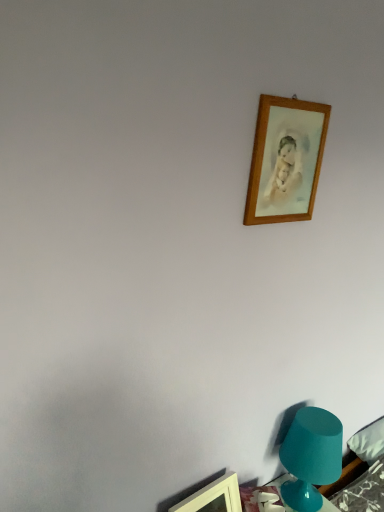
How much space does wooden picture frame at upper right, which is counted as the second picture frame, starting from the bottom, occupy horizontally?

It is 0.87 inches.

The width and height of the screenshot is (384, 512). What do you see at coordinates (286, 160) in the screenshot?
I see `wooden picture frame at upper right, which ranks as the 1th picture frame in right-to-left order` at bounding box center [286, 160].

The width and height of the screenshot is (384, 512). Find the location of `teal glass lamp at lower right`. teal glass lamp at lower right is located at coordinates (305, 468).

Locate an element on the screen. wooden picture frame at upper right, positioned as the 2th picture frame in right-to-left order is located at coordinates (214, 497).

How different are the orientations of teal glass lamp at lower right and wooden picture frame at upper right, acting as the first picture frame starting from the top, in degrees?

2.24 degrees.

Is wooden picture frame at upper right, which ranks as the second picture frame in left-to-right order, located within teal glass lamp at lower right?

No, teal glass lamp at lower right does not contain wooden picture frame at upper right, which ranks as the second picture frame in left-to-right order.

Is the depth of teal glass lamp at lower right less than that of wooden picture frame at upper right, which ranks as the second picture frame in left-to-right order?

No, it is behind wooden picture frame at upper right, which ranks as the second picture frame in left-to-right order.

Considering the positions of objects wooden picture frame at upper right, positioned as the 2th picture frame in right-to-left order, and wooden picture frame at upper right, which ranks as the 1th picture frame in right-to-left order, in the image provided, who is more to the left, wooden picture frame at upper right, positioned as the 2th picture frame in right-to-left order, or wooden picture frame at upper right, which ranks as the 1th picture frame in right-to-left order,?

wooden picture frame at upper right, positioned as the 2th picture frame in right-to-left order.

Considering the relative sizes of wooden picture frame at upper right, which ranks as the 1th picture frame in bottom-to-top order, and wooden picture frame at upper right, acting as the first picture frame starting from the top, in the image provided, is wooden picture frame at upper right, which ranks as the 1th picture frame in bottom-to-top order, bigger than wooden picture frame at upper right, acting as the first picture frame starting from the top,?

Correct, wooden picture frame at upper right, which ranks as the 1th picture frame in bottom-to-top order, is larger in size than wooden picture frame at upper right, acting as the first picture frame starting from the top.

Is wooden picture frame at upper right, which is the 2th picture frame from top to bottom, looking in the opposite direction of wooden picture frame at upper right, which is counted as the second picture frame, starting from the bottom?

No, wooden picture frame at upper right, which is the 2th picture frame from top to bottom, is not facing the opposite direction of wooden picture frame at upper right, which is counted as the second picture frame, starting from the bottom.

Does wooden picture frame at upper right, which ranks as the 1th picture frame in bottom-to-top order, have a greater height compared to wooden picture frame at upper right, which ranks as the 1th picture frame in right-to-left order?

Incorrect, the height of wooden picture frame at upper right, which ranks as the 1th picture frame in bottom-to-top order, is not larger of that of wooden picture frame at upper right, which ranks as the 1th picture frame in right-to-left order.

Considering the positions of objects teal glass lamp at lower right and wooden picture frame at upper right, positioned as the 2th picture frame in right-to-left order, in the image provided, who is in front, teal glass lamp at lower right or wooden picture frame at upper right, positioned as the 2th picture frame in right-to-left order,?

wooden picture frame at upper right, positioned as the 2th picture frame in right-to-left order, is more forward.

From the picture: Is teal glass lamp at lower right wider or thinner than wooden picture frame at upper right, positioned as the 2th picture frame in right-to-left order?

Considering their sizes, teal glass lamp at lower right looks broader than wooden picture frame at upper right, positioned as the 2th picture frame in right-to-left order.

In the scene shown: From a real-world perspective, who is located lower, teal glass lamp at lower right or wooden picture frame at upper right, which is the 2th picture frame from top to bottom?

wooden picture frame at upper right, which is the 2th picture frame from top to bottom, from a real-world perspective.

Looking at this image, between wooden picture frame at upper right, which is counted as the second picture frame, starting from the bottom, and teal glass lamp at lower right, which one appears on the left side from the viewer's perspective?

From the viewer's perspective, wooden picture frame at upper right, which is counted as the second picture frame, starting from the bottom, appears more on the left side.

From a real-world perspective, is wooden picture frame at upper right, which ranks as the second picture frame in left-to-right order, physically located above or below teal glass lamp at lower right?

wooden picture frame at upper right, which ranks as the second picture frame in left-to-right order, is situated higher than teal glass lamp at lower right in the real world.

Is wooden picture frame at upper right, which ranks as the 1th picture frame in right-to-left order, with teal glass lamp at lower right?

They are not placed beside each other.

Between wooden picture frame at upper right, which ranks as the 1th picture frame in right-to-left order, and teal glass lamp at lower right, which one has more height?

Standing taller between the two is teal glass lamp at lower right.

Is wooden picture frame at upper right, which is counted as the second picture frame, starting from the bottom, bigger or smaller than wooden picture frame at upper right, which is the 2th picture frame from top to bottom?

Considering their sizes, wooden picture frame at upper right, which is counted as the second picture frame, starting from the bottom, takes up less space than wooden picture frame at upper right, which is the 2th picture frame from top to bottom.

Is wooden picture frame at upper right, which ranks as the 1th picture frame in right-to-left order, with wooden picture frame at upper right, which ranks as the 1th picture frame in bottom-to-top order?

No, wooden picture frame at upper right, which ranks as the 1th picture frame in right-to-left order, is not making contact with wooden picture frame at upper right, which ranks as the 1th picture frame in bottom-to-top order.

Is wooden picture frame at upper right, acting as the first picture frame starting from the top, thinner than wooden picture frame at upper right, positioned as the 2th picture frame in right-to-left order?

Yes, wooden picture frame at upper right, acting as the first picture frame starting from the top, is thinner than wooden picture frame at upper right, positioned as the 2th picture frame in right-to-left order.

From a real-world perspective, is wooden picture frame at upper right, acting as the first picture frame starting from the top, physically located above or below wooden picture frame at upper right, which is the 2th picture frame from top to bottom?

wooden picture frame at upper right, acting as the first picture frame starting from the top, is above wooden picture frame at upper right, which is the 2th picture frame from top to bottom.

Is wooden picture frame at upper right, placed as the 1th picture frame when sorted from left to right, not near teal glass lamp at lower right?

They are positioned close to each other.

From the image's perspective, which object appears higher, wooden picture frame at upper right, positioned as the 2th picture frame in right-to-left order, or teal glass lamp at lower right?

teal glass lamp at lower right.

Which of these two, wooden picture frame at upper right, which ranks as the 1th picture frame in bottom-to-top order, or teal glass lamp at lower right, is wider?

Wider between the two is teal glass lamp at lower right.

Where is `picture frame above the teal glass lamp at lower right (from a real-world perspective)`? Image resolution: width=384 pixels, height=512 pixels. picture frame above the teal glass lamp at lower right (from a real-world perspective) is located at coordinates (286, 160).

The width and height of the screenshot is (384, 512). Find the location of `picture frame below the wooden picture frame at upper right, which ranks as the 1th picture frame in right-to-left order (from the image's perspective)`. picture frame below the wooden picture frame at upper right, which ranks as the 1th picture frame in right-to-left order (from the image's perspective) is located at coordinates (214, 497).

Consider the image. Based on their spatial positions, is wooden picture frame at upper right, acting as the first picture frame starting from the top, or teal glass lamp at lower right further from wooden picture frame at upper right, placed as the 1th picture frame when sorted from left to right?

wooden picture frame at upper right, acting as the first picture frame starting from the top, is positioned further to the anchor wooden picture frame at upper right, placed as the 1th picture frame when sorted from left to right.

From the image, which object appears to be farther from teal glass lamp at lower right, wooden picture frame at upper right, which is counted as the second picture frame, starting from the bottom, or wooden picture frame at upper right, which is the 2th picture frame from top to bottom?

wooden picture frame at upper right, which is counted as the second picture frame, starting from the bottom.

When comparing their distances from teal glass lamp at lower right, does wooden picture frame at upper right, which is the 2th picture frame from top to bottom, or wooden picture frame at upper right, which ranks as the 1th picture frame in right-to-left order, seem further?

Among the two, wooden picture frame at upper right, which ranks as the 1th picture frame in right-to-left order, is located further to teal glass lamp at lower right.

Based on their spatial positions, is teal glass lamp at lower right or wooden picture frame at upper right, placed as the 1th picture frame when sorted from left to right, further from wooden picture frame at upper right, which ranks as the 1th picture frame in right-to-left order?

wooden picture frame at upper right, placed as the 1th picture frame when sorted from left to right, is further to wooden picture frame at upper right, which ranks as the 1th picture frame in right-to-left order.

Looking at this image, from the image, which object appears to be nearer to wooden picture frame at upper right, which is counted as the second picture frame, starting from the bottom, wooden picture frame at upper right, positioned as the 2th picture frame in right-to-left order, or teal glass lamp at lower right?

teal glass lamp at lower right is positioned closer to the anchor wooden picture frame at upper right, which is counted as the second picture frame, starting from the bottom.

Looking at this image, considering their positions, is teal glass lamp at lower right positioned further to wooden picture frame at upper right, positioned as the 2th picture frame in right-to-left order, than wooden picture frame at upper right, which ranks as the 1th picture frame in right-to-left order?

Among the two, wooden picture frame at upper right, which ranks as the 1th picture frame in right-to-left order, is located further to wooden picture frame at upper right, positioned as the 2th picture frame in right-to-left order.

Identify the location of furniture between wooden picture frame at upper right, acting as the first picture frame starting from the top, and wooden picture frame at upper right, positioned as the 2th picture frame in right-to-left order, in the vertical direction. (305, 468).